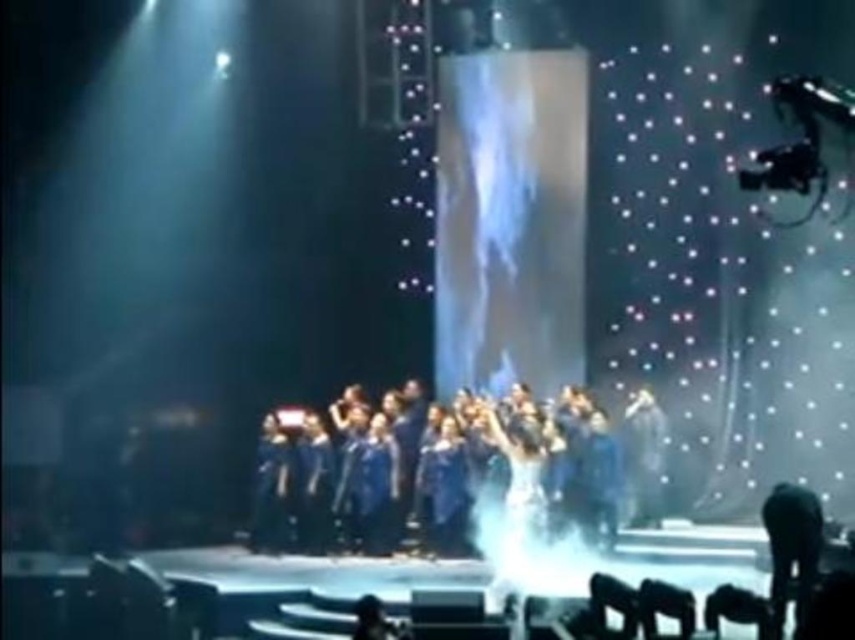
You are a stagehand preparing to adjust the lighting for the performance. You notice the blue fabric group at center and the black fabric microphone at lower right. Which object is positioned lower in the scene?

The blue fabric group at center is positioned below the black fabric microphone at lower right, so the blue fabric group at center is lower in the scene.

You are a photographer positioned at the front of the stage. You want to capture a photo where both the black fabric microphone at lower right and the shiny silver dress at center are visible. Based on their positions, which object should you ensure is in the lower part of your frame?

The black fabric microphone at lower right is below the shiny silver dress at center, so to include both in the photo, you should ensure the black fabric microphone at lower right is in the lower part of your frame.

You are a stagehand who needs to move a 1.5 meter wide equipment cart from the back of the stage to the front. There is a blue fabric group at center and a shiny silver dress at center in the way. Can the cart pass between them?

The blue fabric group at center is 3.07 meters away from the shiny silver dress at center. Since the cart is 1.5 meters wide, there is enough space between them for the cart to pass through.